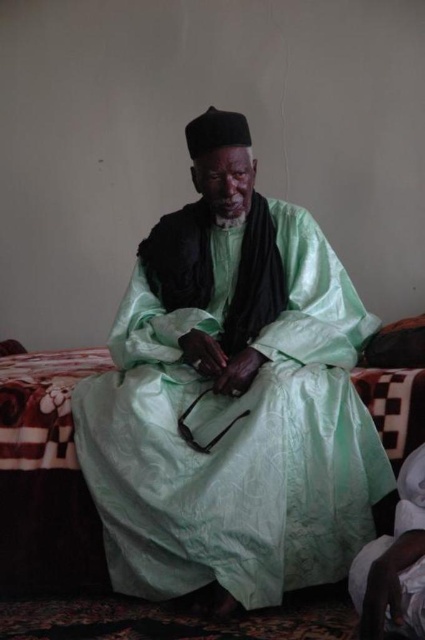
Question: Is matte green silk robe at center to the left of patterned fabric bed at center from the viewer's perspective?

Choices:
 (A) no
 (B) yes

Answer: (A)

Question: Which point appears farthest from the camera in this image?

Choices:
 (A) (382, 339)
 (B) (299, 323)

Answer: (A)

Question: Can you confirm if matte green silk robe at center is positioned below patterned fabric bed at center?

Choices:
 (A) yes
 (B) no

Answer: (B)

Question: Does matte green silk robe at center appear on the left side of patterned fabric bed at center?

Choices:
 (A) yes
 (B) no

Answer: (B)

Question: Which point is farther to the camera?

Choices:
 (A) (359, 403)
 (B) (391, 346)

Answer: (B)